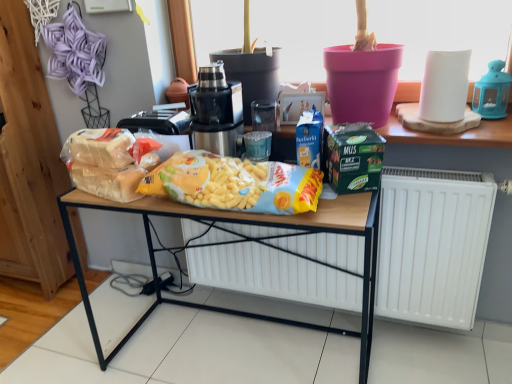
Locate an element on the screen. free location above translucent plastic bag at center, the 2th waste viewed from the right (from a real-world perspective) is located at coordinates (101, 164).